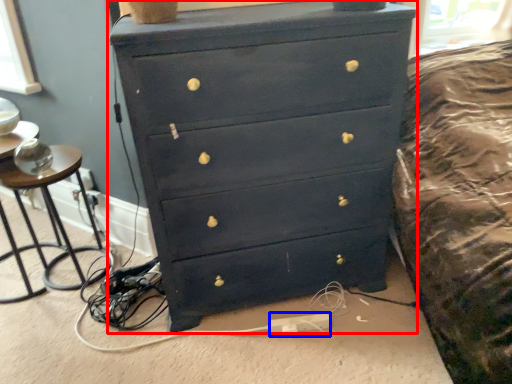
Question: Which of the following is the farthest to the observer, chest of drawers (highlighted by a red box) or extension cord (highlighted by a blue box)?

Choices:
 (A) chest of drawers
 (B) extension cord

Answer: (B)